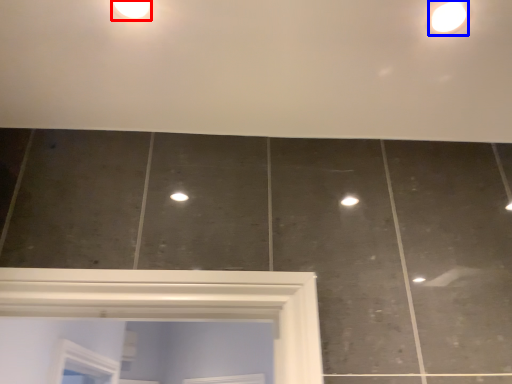
Question: Among these objects, which one is farthest to the camera, droplight (highlighted by a red box) or light fixture (highlighted by a blue box)?

Choices:
 (A) droplight
 (B) light fixture

Answer: (B)